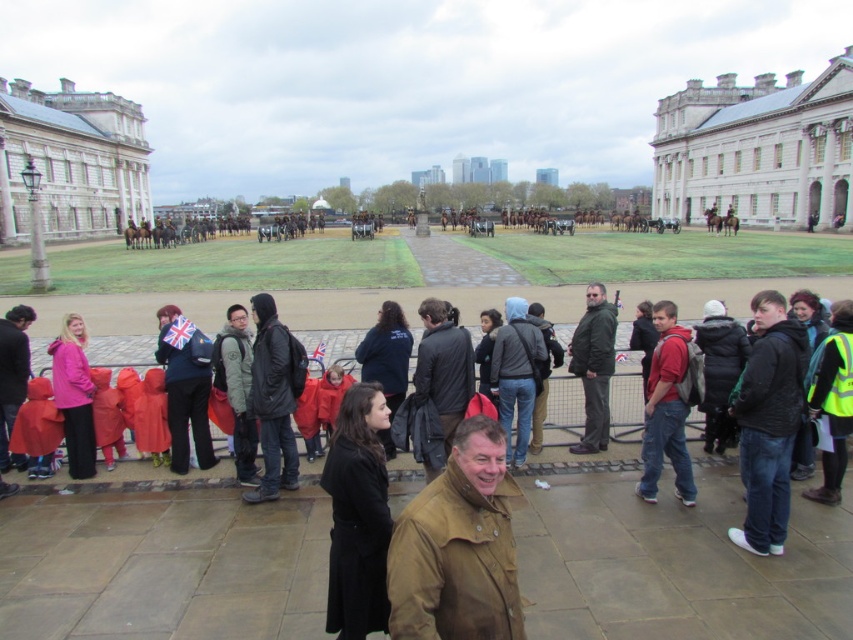
Question: Among these objects, which one is farthest from the camera?

Choices:
 (A) dark gray jacket at center
 (B) dark green jacket at center

Answer: (B)

Question: Does brown leather jacket at center appear over dark gray jacket at center?

Choices:
 (A) no
 (B) yes

Answer: (A)

Question: From the image, what is the correct spatial relationship of brown leather jacket at center in relation to matte red jacket at center?

Choices:
 (A) right
 (B) left

Answer: (B)

Question: Which object appears farthest from the camera in this image?

Choices:
 (A) dark green jacket at center
 (B) matte red jacket at center
 (C) white stone building at upper right
 (D) brown leather jacket at center

Answer: (C)

Question: Does white stone building at upper right appear over white glossy building at upper left?

Choices:
 (A) yes
 (B) no

Answer: (A)

Question: Which point is farther to the camera?

Choices:
 (A) (448, 358)
 (B) (647, 490)
 (C) (718, 182)

Answer: (C)